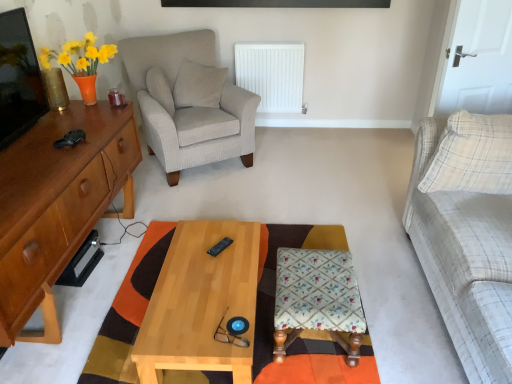
Locate an element on the screen. This screenshot has width=512, height=384. spots to the right of floral fabric stool at center is located at coordinates (398, 321).